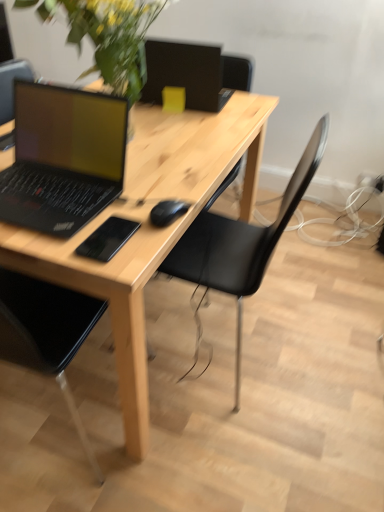
At what (x,y) coordinates should I click in order to perform the action: click on free space in front of black plastic chair at center. Please return your answer as a coordinate pair (x, y). Looking at the image, I should click on (255, 445).